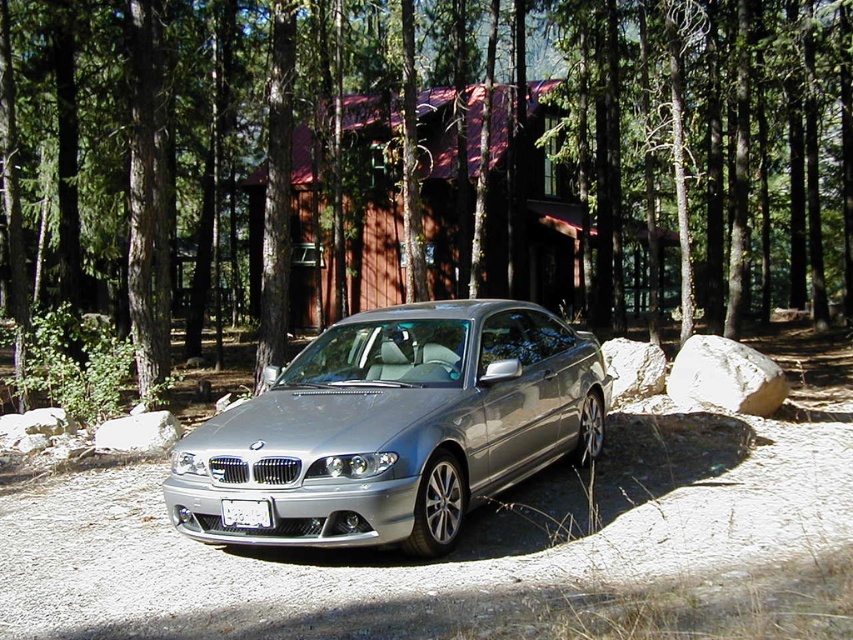
Does point (436, 541) come in front of point (248, 502)?

No, (436, 541) is further to viewer.

Is point (331, 525) positioned before point (223, 515)?

Yes, point (331, 525) is closer to viewer.

Locate an element on the screen. This screenshot has width=853, height=640. satin silver car at center is located at coordinates (395, 426).

Does green matte tree at center appear over satin silver car at center?

Indeed, green matte tree at center is positioned over satin silver car at center.

Can you confirm if green matte tree at center is wider than satin silver car at center?

Correct, the width of green matte tree at center exceeds that of satin silver car at center.

Find the location of a particular element. This screenshot has height=640, width=853. green matte tree at center is located at coordinates (428, 163).

This screenshot has width=853, height=640. Identify the location of green matte tree at center. (428, 163).

Can you confirm if white smooth rock at right is shorter than white plastic license plate at center?

No, white smooth rock at right is not shorter than white plastic license plate at center.

Based on the photo, which of these two, white smooth rock at right or white plastic license plate at center, stands taller?

white smooth rock at right is taller.

From the picture: Who is more distant from viewer, (x=706, y=355) or (x=247, y=509)?

Positioned behind is point (x=706, y=355).

Where is `white smooth rock at right`? This screenshot has width=853, height=640. white smooth rock at right is located at coordinates (724, 378).